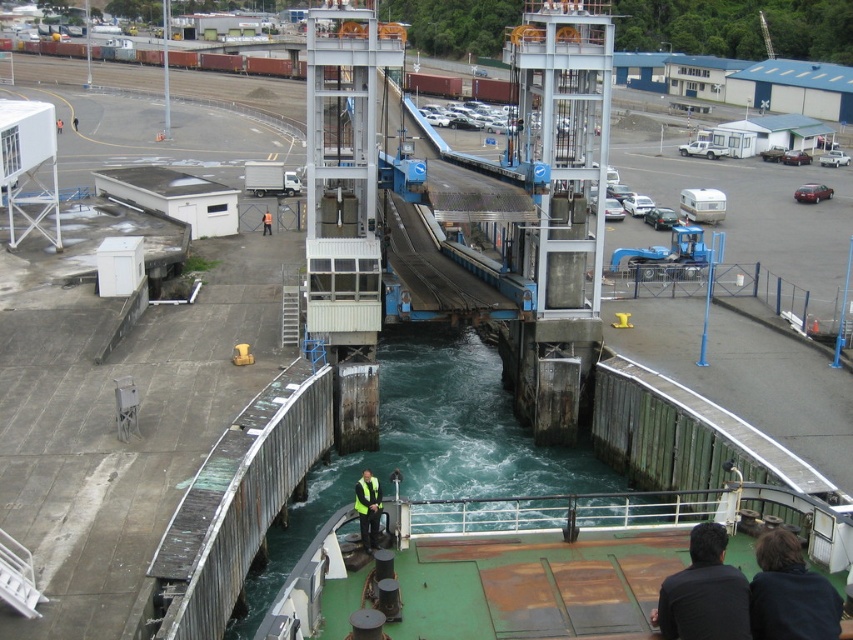
Does greenish-blue water at center appear under dark brown leather jacket at lower right?

Yes, greenish-blue water at center is below dark brown leather jacket at lower right.

Who is positioned more to the right, greenish-blue water at center or dark brown leather jacket at lower right?

Positioned to the right is dark brown leather jacket at lower right.

Locate an element on the screen. This screenshot has height=640, width=853. greenish-blue water at center is located at coordinates (432, 449).

Find the location of a particular element. greenish-blue water at center is located at coordinates click(x=432, y=449).

Between point (323, 608) and point (267, 224), which one is positioned in front?

Point (323, 608) is in front.

Is rusty metal boat at center taller than orange reflective vest at center?

Correct, rusty metal boat at center is much taller as orange reflective vest at center.

This screenshot has height=640, width=853. What are the coordinates of `rusty metal boat at center` in the screenshot? It's located at (529, 563).

The height and width of the screenshot is (640, 853). Identify the location of rusty metal boat at center. (529, 563).

Is rusty metal boat at center behind black fabric at lower right?

Yes, it is.

Can you confirm if rusty metal boat at center is positioned to the left of black fabric at lower right?

Correct, you'll find rusty metal boat at center to the left of black fabric at lower right.

Describe the element at coordinates (529, 563) in the screenshot. I see `rusty metal boat at center` at that location.

At what (x,y) coordinates should I click in order to perform the action: click on rusty metal boat at center. Please return your answer as a coordinate pair (x, y). The height and width of the screenshot is (640, 853). Looking at the image, I should click on (529, 563).